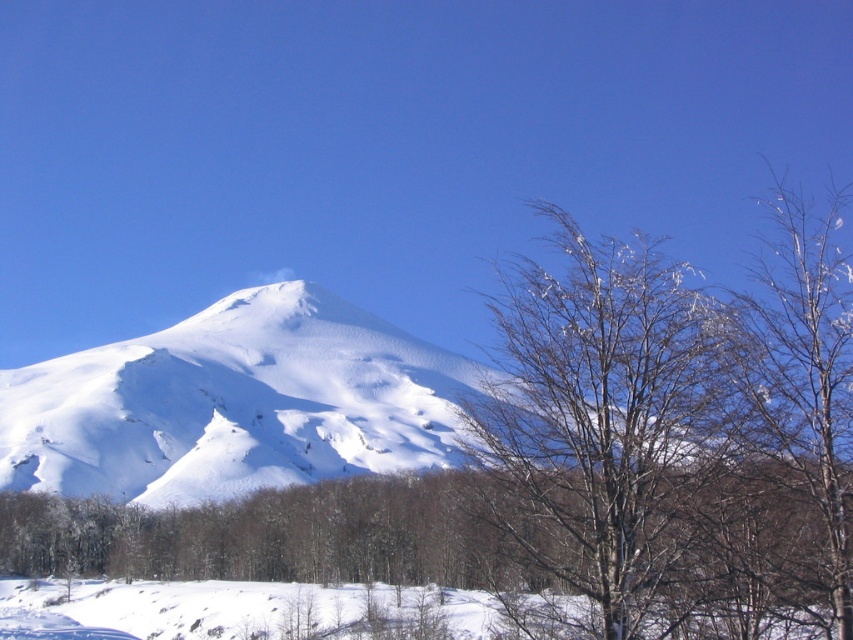
The height and width of the screenshot is (640, 853). Identify the location of bare wood tree at center. (608, 429).

Where is `bare wood tree at center`? bare wood tree at center is located at coordinates (608, 429).

This screenshot has height=640, width=853. I want to click on bare wood tree at center, so click(608, 429).